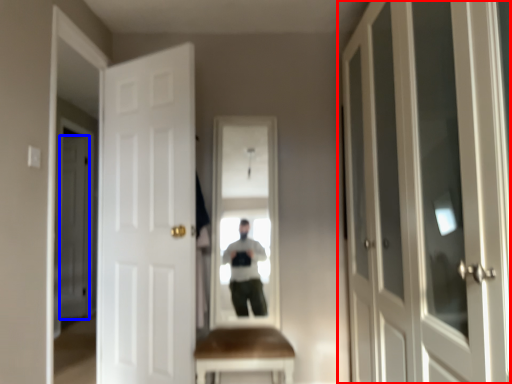
Question: Among these objects, which one is nearest to the camera, door (highlighted by a red box) or door (highlighted by a blue box)?

Choices:
 (A) door
 (B) door

Answer: (A)